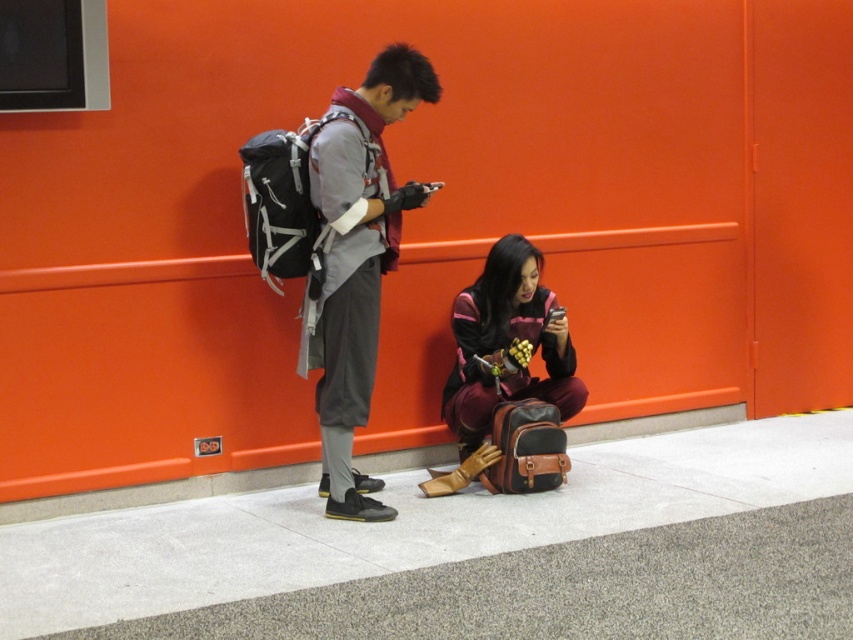
You are a delivery person who needs to place a large package on the ground. You see the matte gray backpack at left and the concrete curb at lower center. Which object is more suitable for placing the package on top of it?

The matte gray backpack at left is bigger than the concrete curb at lower center, so it would provide a more stable and level surface for placing the large package.

You are standing in the scene and want to place a small potted plant on the gray concrete pavement at lower center. What are the coordinates where you should place it?

The gray concrete pavement at lower center is located at coordinates point (476, 552), so you should place the potted plant there.

You are a delivery person who needs to place a package on the concrete curb at lower center. You see the matte gray backpack at left in the way. Can you move the backpack to access the curb?

The matte gray backpack at left is in front of the concrete curb at lower center, so you need to move the backpack to access the curb.